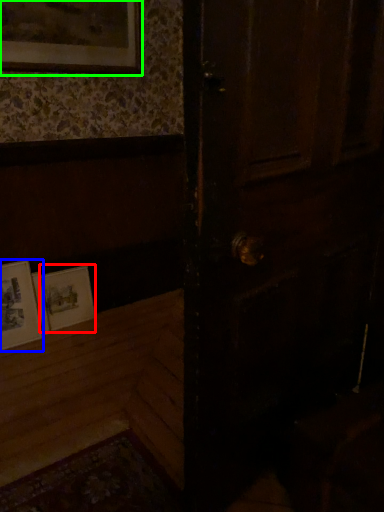
Question: Based on their relative distances, which object is farther from picture frame (highlighted by a red box)? Choose from picture frame (highlighted by a blue box) and picture frame (highlighted by a green box).

Choices:
 (A) picture frame
 (B) picture frame

Answer: (B)